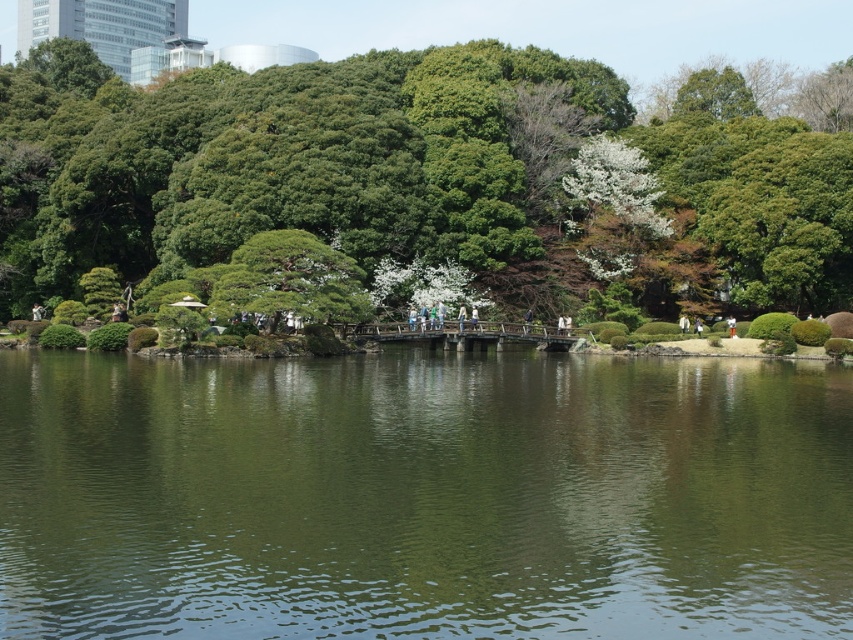
Question: Among these objects, which one is nearest to the camera?

Choices:
 (A) green reflective water at center
 (B) green leafy tree at center

Answer: (A)

Question: Considering the relative positions of green reflective water at center and green leafy tree at center in the image provided, where is green reflective water at center located with respect to green leafy tree at center?

Choices:
 (A) above
 (B) below

Answer: (B)

Question: Which point is farther to the camera?

Choices:
 (A) green leafy tree at center
 (B) green reflective water at center

Answer: (A)

Question: Does green reflective water at center have a larger size compared to green leafy tree at center?

Choices:
 (A) no
 (B) yes

Answer: (A)

Question: Is the position of green reflective water at center less distant than that of green leafy tree at center?

Choices:
 (A) yes
 (B) no

Answer: (A)

Question: Which of the following is the closest to the observer?

Choices:
 (A) green leafy tree at center
 (B) green reflective water at center

Answer: (B)